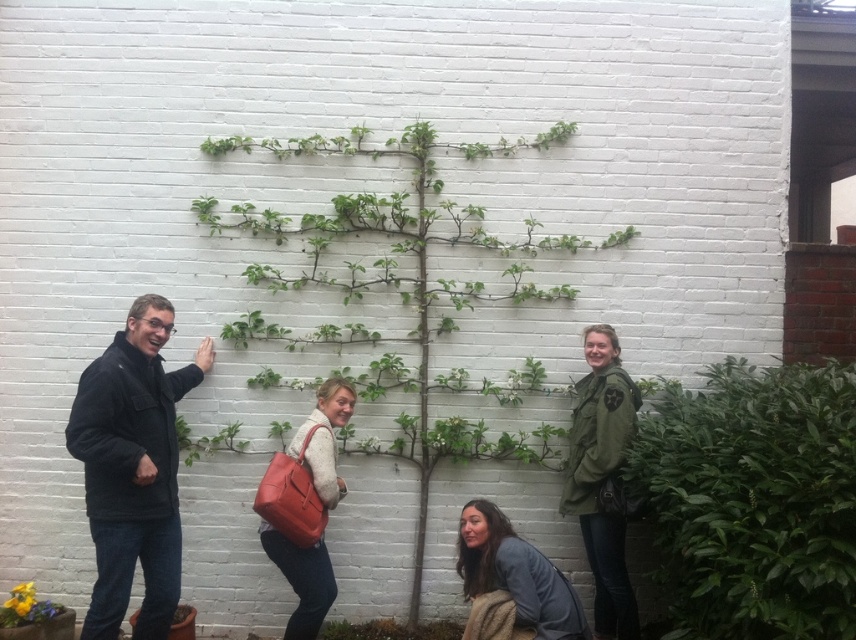
Question: Does green leafy plant at center lie in front of green matte jacket at right?

Choices:
 (A) yes
 (B) no

Answer: (B)

Question: Does green leafy bush at right appear over gray fabric jacket at lower center?

Choices:
 (A) no
 (B) yes

Answer: (B)

Question: Which of these objects is positioned farthest from the matte brown leather bag at center?

Choices:
 (A) green leafy plant at center
 (B) dark gray fleece jacket at left

Answer: (A)

Question: Observing the image, what is the correct spatial positioning of green leafy plant at center in reference to gray fabric jacket at lower center?

Choices:
 (A) above
 (B) below

Answer: (A)

Question: Which point is closer to the camera?

Choices:
 (A) (610, 472)
 (B) (675, 545)
 (C) (412, 576)

Answer: (B)

Question: Which of the following is the closest to the observer?

Choices:
 (A) green leafy plant at center
 (B) gray fabric jacket at lower center
 (C) yellow flower pot at lower left

Answer: (B)